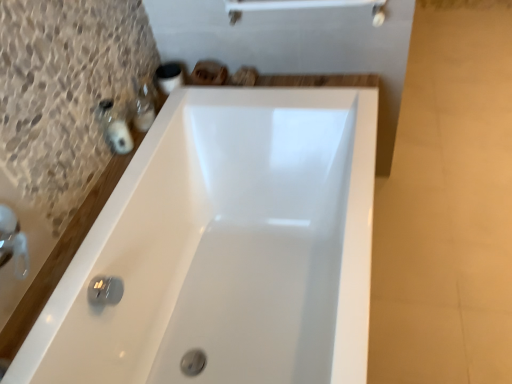
Question: Is the surface of matte black soap at left, placed as the 1th toiletry when sorted from front to back, in direct contact with white glossy bathtub at center?

Choices:
 (A) yes
 (B) no

Answer: (B)

Question: Is matte black soap at left, the 2th toiletry when ordered from back to front, located outside white glossy bathtub at center?

Choices:
 (A) yes
 (B) no

Answer: (A)

Question: Is white glossy bathtub at center located within matte black soap at left, placed as the 1th toiletry when sorted from front to back?

Choices:
 (A) no
 (B) yes

Answer: (A)

Question: Is matte black soap at left, the 2th toiletry when ordered from back to front, aimed at white glossy bathtub at center?

Choices:
 (A) no
 (B) yes

Answer: (A)

Question: Does matte black soap at left, placed as the 1th toiletry when sorted from front to back, have a greater height compared to white glossy bathtub at center?

Choices:
 (A) no
 (B) yes

Answer: (A)

Question: In the image, is matte black soap at left, placed as the 1th toiletry when sorted from front to back, positioned in front of or behind white glossy bathtub at center?

Choices:
 (A) behind
 (B) front

Answer: (A)

Question: Is matte black soap at left, placed as the 1th toiletry when sorted from front to back, taller or shorter than white glossy bathtub at center?

Choices:
 (A) tall
 (B) short

Answer: (B)

Question: From a real-world perspective, relative to white glossy bathtub at center, is matte black soap at left, placed as the 1th toiletry when sorted from front to back, vertically above or below?

Choices:
 (A) below
 (B) above

Answer: (B)

Question: From the image's perspective, is matte black soap at left, the 2th toiletry when ordered from back to front, above or below white glossy bathtub at center?

Choices:
 (A) above
 (B) below

Answer: (A)

Question: From their relative heights in the image, would you say matte black soap at left, placed as the 1th toiletry when sorted from front to back, is taller or shorter than matte plastic soap dispenser at upper left, which is the 2th toiletry from front to back?

Choices:
 (A) tall
 (B) short

Answer: (A)

Question: From a real-world perspective, is matte black soap at left, placed as the 1th toiletry when sorted from front to back, physically located above or below matte plastic soap dispenser at upper left, which is the 2th toiletry from front to back?

Choices:
 (A) above
 (B) below

Answer: (A)

Question: Is matte black soap at left, placed as the 1th toiletry when sorted from front to back, bigger or smaller than matte plastic soap dispenser at upper left, arranged as the 1th toiletry when viewed from the back?

Choices:
 (A) big
 (B) small

Answer: (B)

Question: Choose the correct answer: Is matte black soap at left, placed as the 1th toiletry when sorted from front to back, inside matte plastic soap dispenser at upper left, which is the 2th toiletry from front to back, or outside it?

Choices:
 (A) inside
 (B) outside

Answer: (B)

Question: From a real-world perspective, is matte plastic soap dispenser at upper left, arranged as the 1th toiletry when viewed from the back, positioned above or below matte black soap at left, placed as the 1th toiletry when sorted from front to back?

Choices:
 (A) above
 (B) below

Answer: (B)

Question: Looking at the image, does matte plastic soap dispenser at upper left, which is the 2th toiletry from front to back, seem bigger or smaller compared to matte black soap at left, placed as the 1th toiletry when sorted from front to back?

Choices:
 (A) big
 (B) small

Answer: (A)